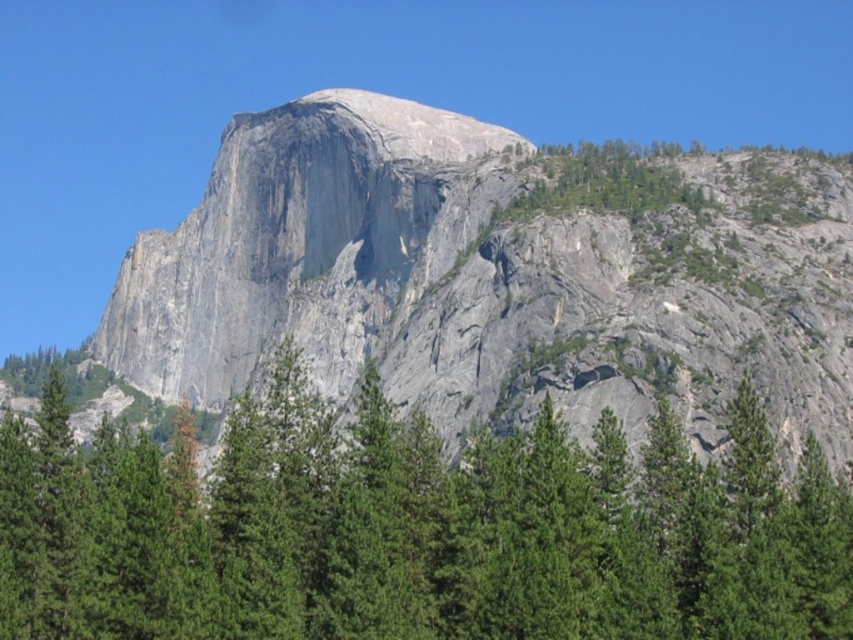
Who is shorter, green textured pine tree at center or green leafy trees at upper right?

With less height is green leafy trees at upper right.

Can you confirm if green textured pine tree at center is bigger than green leafy trees at upper right?

Yes, green textured pine tree at center is bigger than green leafy trees at upper right.

Does point (625, 524) come farther from viewer compared to point (587, 148)?

No, (625, 524) is in front of (587, 148).

Where is `green textured pine tree at center`? This screenshot has height=640, width=853. green textured pine tree at center is located at coordinates (415, 531).

Who is higher up, gray rock mountain at center or green leafy trees at upper right?

green leafy trees at upper right is higher up.

Does gray rock mountain at center have a lesser height compared to green leafy trees at upper right?

No.

Between point (352, 275) and point (682, 193), which one is positioned in front?

Point (682, 193) is in front.

Where is `gray rock mountain at center`? gray rock mountain at center is located at coordinates (490, 278).

Is gray rock mountain at center thinner than green textured pine tree at center?

Incorrect, gray rock mountain at center's width is not less than green textured pine tree at center's.

In the scene shown: Which of these two, gray rock mountain at center or green textured pine tree at center, stands shorter?

With less height is green textured pine tree at center.

Locate an element on the screen. This screenshot has width=853, height=640. gray rock mountain at center is located at coordinates (490, 278).

Where is `gray rock mountain at center`? The width and height of the screenshot is (853, 640). gray rock mountain at center is located at coordinates (490, 278).